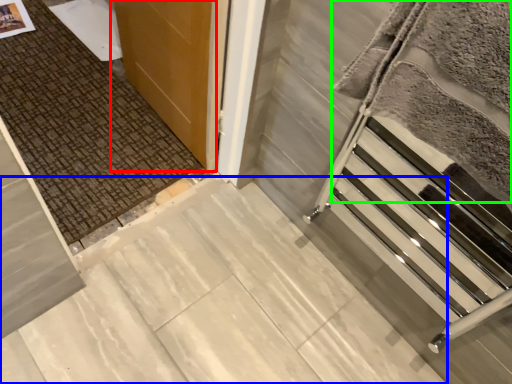
Question: Considering the real-world distances, which object is closest to door (highlighted by a red box)? concrete (highlighted by a blue box) or blanket (highlighted by a green box).

Choices:
 (A) concrete
 (B) blanket

Answer: (A)